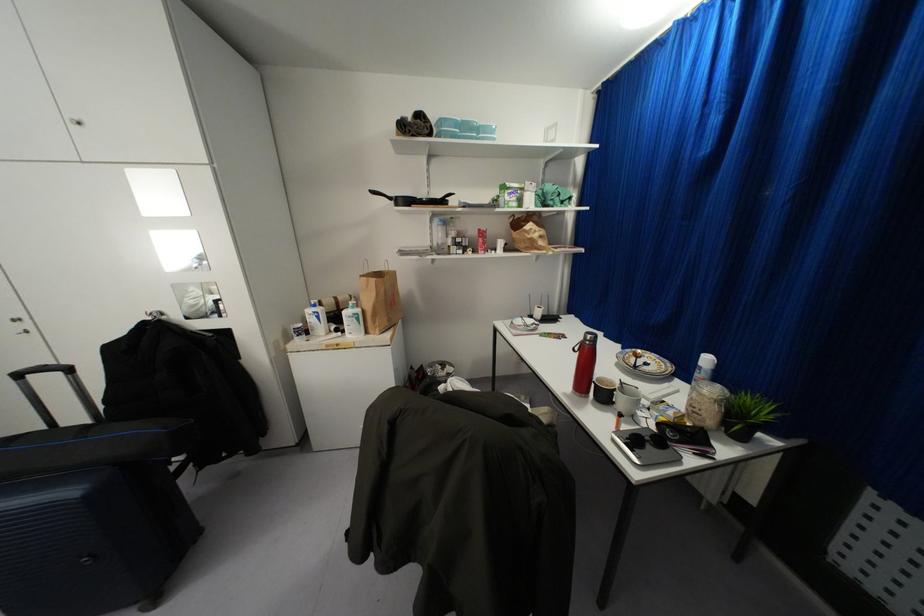
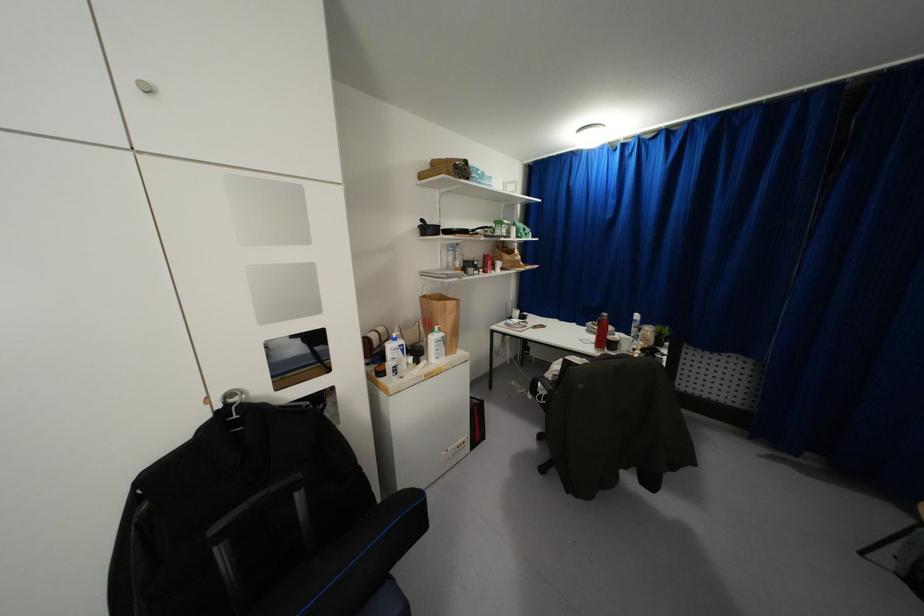
The point at (358, 310) is marked in the first image. Where is the corresponding point in the second image?

(442, 333)